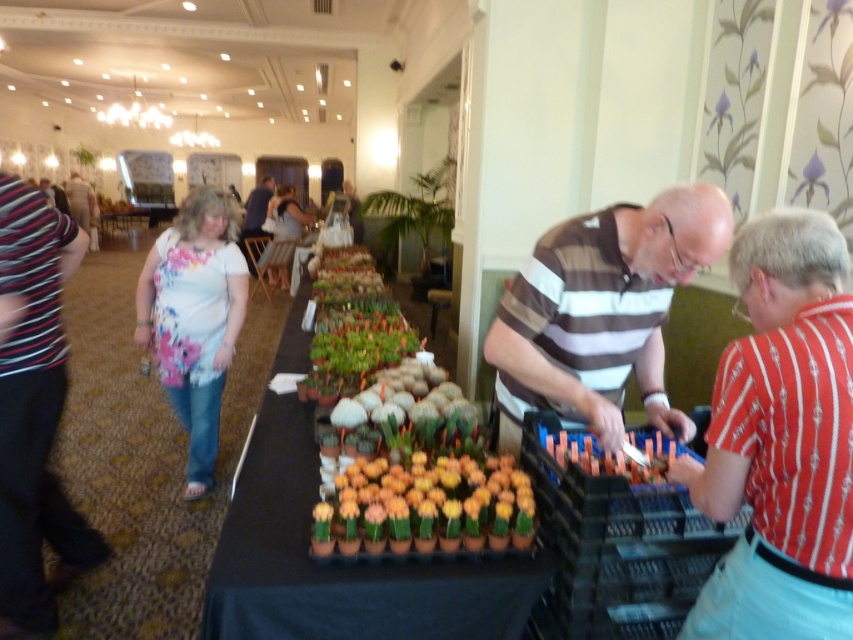
Question: Does red striped shirt at right have a smaller size compared to yellow-green succulent at center?

Choices:
 (A) yes
 (B) no

Answer: (B)

Question: Which point is farther to the camera?

Choices:
 (A) brown striped shirt at center
 (B) matte floral shirt at upper left
 (C) striped shirt at center

Answer: (B)

Question: Is red striped shirt at right below green matte succulents at center?

Choices:
 (A) no
 (B) yes

Answer: (A)

Question: Is floral fabric blouse at center positioned behind matte floral shirt at upper left?

Choices:
 (A) no
 (B) yes

Answer: (A)

Question: Which point appears farthest from the camera in this image?

Choices:
 (A) (682, 228)
 (B) (378, 600)

Answer: (A)

Question: Which point is closer to the camera?

Choices:
 (A) (93, 212)
 (B) (253, 209)
 (C) (213, 275)
 (D) (640, 324)

Answer: (D)